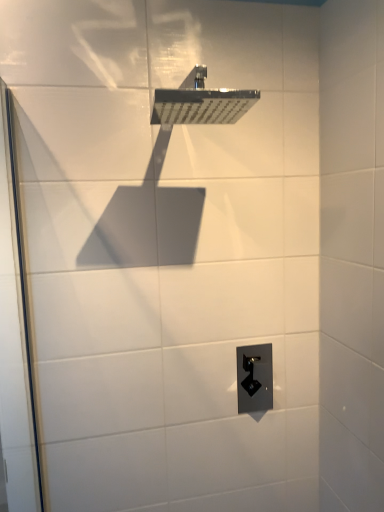
What do you see at coordinates (200, 103) in the screenshot?
I see `polished chrome shower head at upper center` at bounding box center [200, 103].

Describe the element at coordinates (15, 339) in the screenshot. I see `transparent glass screen door at left` at that location.

What are the coordinates of `transparent glass screen door at left` in the screenshot? It's located at (15, 339).

The height and width of the screenshot is (512, 384). Find the location of `black plastic outlet at lower center`. black plastic outlet at lower center is located at coordinates (254, 378).

Is point (215, 112) closer or farther from the camera than point (15, 219)?

Point (215, 112).

Choose the correct answer: Is polished chrome shower head at upper center inside transparent glass screen door at left or outside it?

The correct answer is: outside.

Can you confirm if polished chrome shower head at upper center is thinner than transparent glass screen door at left?

No, polished chrome shower head at upper center is not thinner than transparent glass screen door at left.

Considering the relative positions of polished chrome shower head at upper center and transparent glass screen door at left in the image provided, is polished chrome shower head at upper center to the left of transparent glass screen door at left from the viewer's perspective?

In fact, polished chrome shower head at upper center is to the right of transparent glass screen door at left.

Where is `electric outlet below the polished chrome shower head at upper center (from the image's perspective)`? The width and height of the screenshot is (384, 512). electric outlet below the polished chrome shower head at upper center (from the image's perspective) is located at coordinates (254, 378).

Can you confirm if black plastic outlet at lower center is positioned to the left of polished chrome shower head at upper center?

No.

Which point is more distant from viewer, (x=247, y=351) or (x=204, y=79)?

The point (x=247, y=351) is more distant.

Between black plastic outlet at lower center and polished chrome shower head at upper center, which one is positioned behind?

black plastic outlet at lower center.

Considering the sizes of black plastic outlet at lower center and transparent glass screen door at left in the image, is black plastic outlet at lower center bigger or smaller than transparent glass screen door at left?

In the image, black plastic outlet at lower center appears to be smaller than transparent glass screen door at left.

Which of these two, black plastic outlet at lower center or transparent glass screen door at left, stands taller?

transparent glass screen door at left.

Is point (237, 350) behind point (5, 405)?

That is True.

From a real-world perspective, who is located higher, black plastic outlet at lower center or transparent glass screen door at left?

From a 3D spatial view, transparent glass screen door at left is above.

Is polished chrome shower head at upper center wider or thinner than black plastic outlet at lower center?

Clearly, polished chrome shower head at upper center has more width compared to black plastic outlet at lower center.

From the image's perspective, between polished chrome shower head at upper center and black plastic outlet at lower center, who is located below?

black plastic outlet at lower center.

Which of these two, polished chrome shower head at upper center or black plastic outlet at lower center, stands taller?

black plastic outlet at lower center.

Is point (154, 106) positioned before point (266, 378)?

Yes, it is in front of point (266, 378).

Between transparent glass screen door at left and black plastic outlet at lower center, which one has less height?

black plastic outlet at lower center is shorter.

Is point (19, 418) positioned before point (259, 358)?

Yes, point (19, 418) is closer to viewer.

Which object is wider, transparent glass screen door at left or black plastic outlet at lower center?

transparent glass screen door at left is wider.

How different are the orientations of transparent glass screen door at left and black plastic outlet at lower center in degrees?

There is a 89.4-degree angle between the facing directions of transparent glass screen door at left and black plastic outlet at lower center.

Are transparent glass screen door at left and polished chrome shower head at upper center making contact?

No, transparent glass screen door at left is not touching polished chrome shower head at upper center.

Which point is more forward, [11,225] or [180,96]?

The point [180,96] is more forward.

Find the location of a particular element. shower above the transparent glass screen door at left (from a real-world perspective) is located at coordinates (200, 103).

Which of these two, transparent glass screen door at left or polished chrome shower head at upper center, is wider?

polished chrome shower head at upper center is wider.

Where is `screen door in front of the polished chrome shower head at upper center`? screen door in front of the polished chrome shower head at upper center is located at coordinates (15, 339).

Where is `shower on the left side of black plastic outlet at lower center`? This screenshot has height=512, width=384. shower on the left side of black plastic outlet at lower center is located at coordinates (200, 103).

Looking at the image, which one is located further to transparent glass screen door at left, polished chrome shower head at upper center or black plastic outlet at lower center?

Based on the image, black plastic outlet at lower center appears to be further to transparent glass screen door at left.

From the image, which object appears to be farther from polished chrome shower head at upper center, black plastic outlet at lower center or transparent glass screen door at left?

black plastic outlet at lower center is further to polished chrome shower head at upper center.

Which object lies nearer to the anchor point transparent glass screen door at left, black plastic outlet at lower center or polished chrome shower head at upper center?

Among the two, polished chrome shower head at upper center is located nearer to transparent glass screen door at left.

Estimate the real-world distances between objects in this image. Which object is closer to black plastic outlet at lower center, polished chrome shower head at upper center or transparent glass screen door at left?

transparent glass screen door at left lies closer to black plastic outlet at lower center than the other object.

From the image, which object appears to be farther from polished chrome shower head at upper center, transparent glass screen door at left or black plastic outlet at lower center?

black plastic outlet at lower center lies further to polished chrome shower head at upper center than the other object.

Considering their positions, is transparent glass screen door at left positioned closer to black plastic outlet at lower center than polished chrome shower head at upper center?

transparent glass screen door at left is positioned closer to the anchor black plastic outlet at lower center.

I want to click on screen door between polished chrome shower head at upper center and black plastic outlet at lower center in the up-down direction, so click(15, 339).